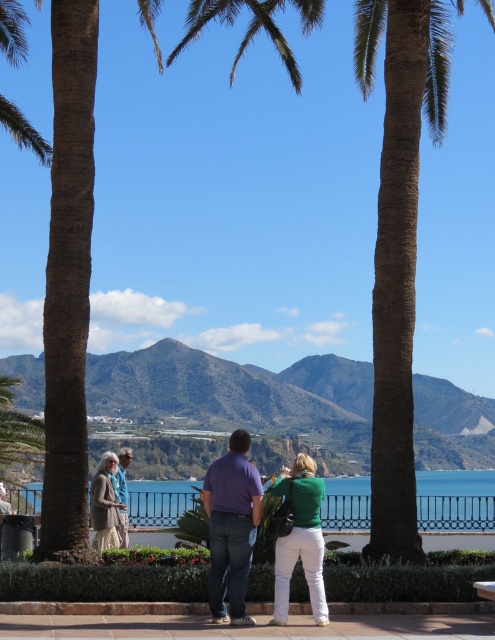
Between point (493, 493) and point (298, 547), which one is positioned in front?

Point (298, 547) is in front.

Does blue water at center appear on the right side of green matte shirt at center?

Yes, blue water at center is to the right of green matte shirt at center.

Identify the location of blue water at center. (455, 500).

Can you confirm if blue water at center is taller than green fabric jacket at center?

Correct, blue water at center is much taller as green fabric jacket at center.

Which of these two, blue water at center or green fabric jacket at center, stands taller?

blue water at center

Where is `blue water at center`? This screenshot has width=495, height=640. blue water at center is located at coordinates [455, 500].

Does purple cotton shirt at center appear on the right side of blue denim jeans at center?

Correct, you'll find purple cotton shirt at center to the right of blue denim jeans at center.

Is point (235, 618) farther from camera compared to point (124, 508)?

No.

Identify the location of purple cotton shirt at center. The image size is (495, 640). (232, 528).